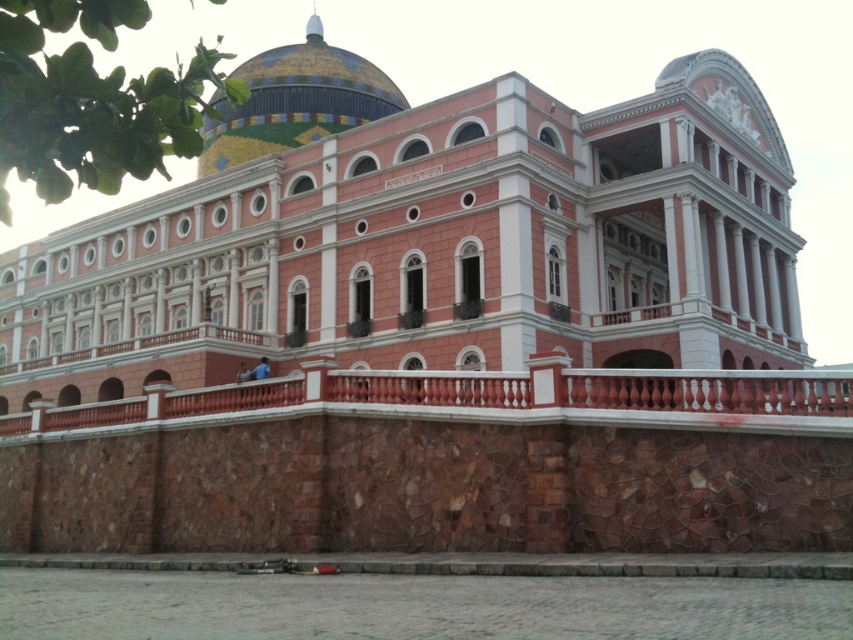
You are an architect designing a new building inspired by this image. You need to ensure that the red stone railing at center and the mosaic tile dome at upper center are proportionate. Based on the scene, which object should be wider in your design?

The red stone railing at center should be wider than the mosaic tile dome at upper center, as the original design specifies that the red stone railing at center has a larger width compared to the dome.

You are standing at the camera position and want to take a photo of the pink stone building at center. If your camera has a maximum focus range of 20 meters, will you be able to focus on the building?

The pink stone building at center and camera are 18.80 meters apart from each other. Since the distance is within the camera maximum focus range of 20 meters, the camera can focus on the building.